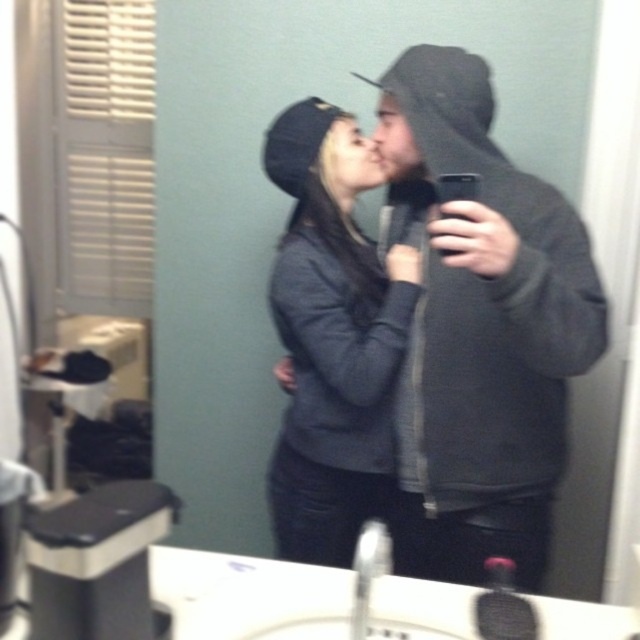
You are a photographer trying to capture a clear selfie of both individuals wearing dark gray hoodie at center and dark gray sweater at center in the bathroom mirror. Since both are moving, which one should you focus on to ensure the subject in front is sharp?

The dark gray hoodie at center is in front of the dark gray sweater at center, so focusing on the dark gray hoodie at center will ensure the subject in front is sharp.

You are trying to locate the dark gray hoodie at center in the bathroom scene. According to the coordinates provided, where exactly is it positioned?

The dark gray hoodie at center is located at point coordinates of 0.514 on the x axis and 0.752 on the y axis.

You are a photographer trying to capture a group photo of two people wearing dark gray hoodie at center and dark gray sweater at center. Since the two are of different sizes, which one should you position closer to the camera to make them appear similar in size in the photo?

The dark gray sweater at center is smaller in size, so positioning it closer to the camera will help balance their apparent sizes in the photo.